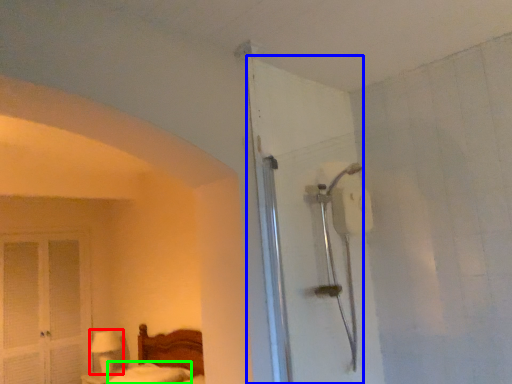
Question: Considering the real-world distances, which object is farthest from table lamp (highlighted by a red box)? door (highlighted by a blue box) or mattress (highlighted by a green box)?

Choices:
 (A) door
 (B) mattress

Answer: (A)